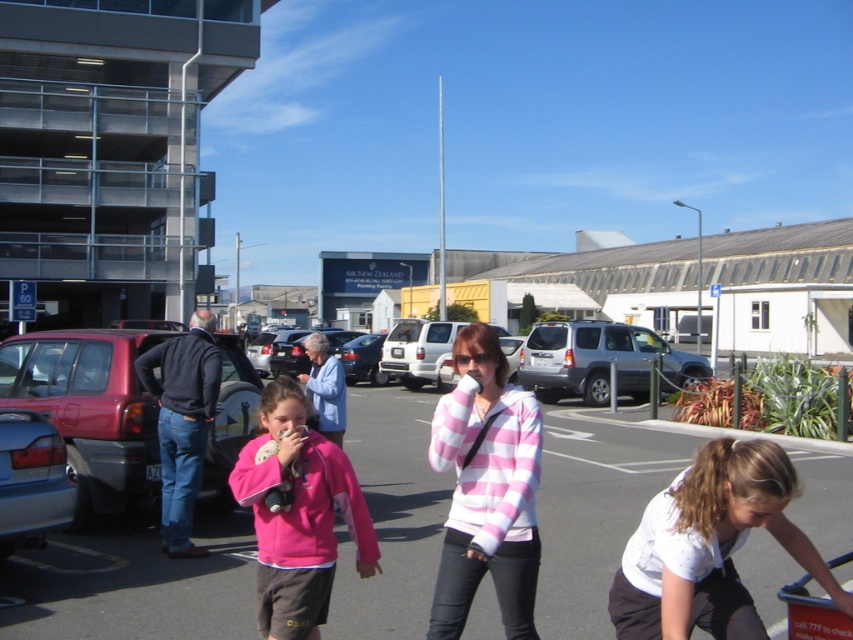
Question: Considering the relative positions of pink striped sweater at center and silver metallic suv at center in the image provided, where is pink striped sweater at center located with respect to silver metallic suv at center?

Choices:
 (A) left
 (B) right

Answer: (A)

Question: Which of the following is the closest to the observer?

Choices:
 (A) (4, 392)
 (B) (281, 545)
 (C) (755, 612)

Answer: (C)

Question: Is matte red car at left to the left of pink fleece jacket at center from the viewer's perspective?

Choices:
 (A) no
 (B) yes

Answer: (B)

Question: Does matte red car at left appear under shiny black sedan at center?

Choices:
 (A) no
 (B) yes

Answer: (A)

Question: Which point is farther from the camera taking this photo?

Choices:
 (A) (369, 349)
 (B) (299, 596)
 (C) (431, 621)
 (D) (753, 611)

Answer: (A)

Question: Which point is closer to the camera?

Choices:
 (A) (436, 531)
 (B) (532, 365)
 (C) (494, 332)
 (D) (270, 579)

Answer: (D)